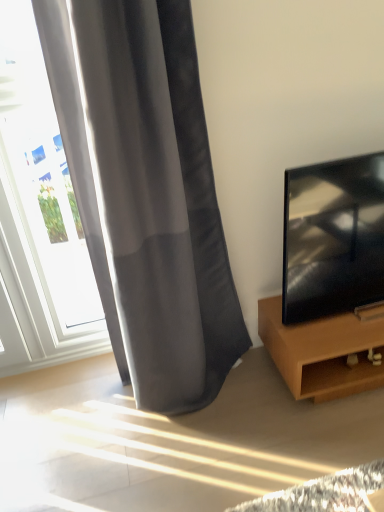
Question: Is white glass window at left positioned before brown wood tv stand at right?

Choices:
 (A) yes
 (B) no

Answer: (A)

Question: Considering the relative positions of white glass window at left and brown wood tv stand at right in the image provided, is white glass window at left to the right of brown wood tv stand at right from the viewer's perspective?

Choices:
 (A) yes
 (B) no

Answer: (B)

Question: Does white glass window at left have a greater height compared to brown wood tv stand at right?

Choices:
 (A) yes
 (B) no

Answer: (A)

Question: Does white glass window at left have a smaller size compared to brown wood tv stand at right?

Choices:
 (A) no
 (B) yes

Answer: (B)

Question: Does white glass window at left appear on the left side of brown wood tv stand at right?

Choices:
 (A) yes
 (B) no

Answer: (A)

Question: Would you say white glass window at left contains brown wood tv stand at right?

Choices:
 (A) no
 (B) yes

Answer: (A)

Question: From the image's perspective, is satin gray curtain at left under white glass window at left?

Choices:
 (A) no
 (B) yes

Answer: (A)

Question: Does satin gray curtain at left have a lesser width compared to white glass window at left?

Choices:
 (A) no
 (B) yes

Answer: (A)

Question: From the image's perspective, would you say satin gray curtain at left is positioned over white glass window at left?

Choices:
 (A) no
 (B) yes

Answer: (B)

Question: Does satin gray curtain at left contain white glass window at left?

Choices:
 (A) no
 (B) yes

Answer: (A)

Question: Is the depth of satin gray curtain at left less than that of white glass window at left?

Choices:
 (A) no
 (B) yes

Answer: (B)

Question: Can you confirm if satin gray curtain at left is smaller than white glass window at left?

Choices:
 (A) yes
 (B) no

Answer: (B)

Question: Considering the relative sizes of black glossy tv at right and satin gray curtain at left in the image provided, is black glossy tv at right smaller than satin gray curtain at left?

Choices:
 (A) yes
 (B) no

Answer: (A)